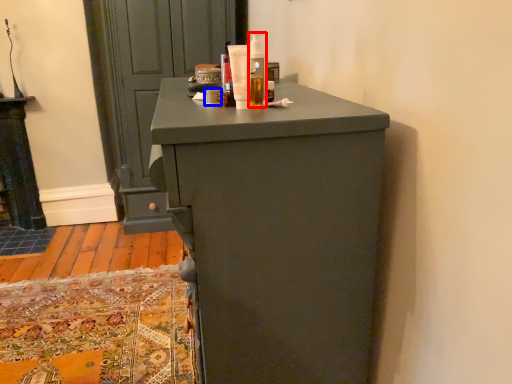
Question: Which of the following is the closest to the observer, toiletry (highlighted by a red box) or toiletry (highlighted by a blue box)?

Choices:
 (A) toiletry
 (B) toiletry

Answer: (A)